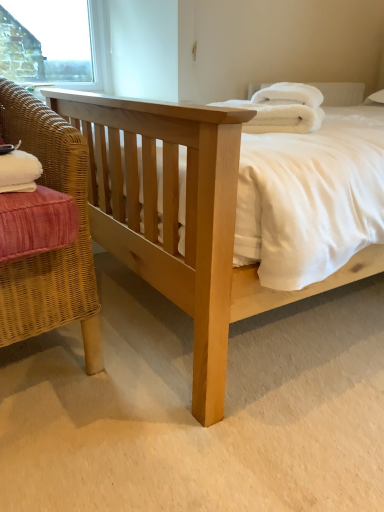
Where is `natural wood bed at center`? This screenshot has width=384, height=512. natural wood bed at center is located at coordinates (186, 220).

At what (x,y) coordinates should I click in order to perform the action: click on white fluffy pillow at upper center. Please return your answer as a coordinate pair (x, y). This screenshot has height=512, width=384. Looking at the image, I should click on (340, 93).

Measure the distance between point (82, 186) and camera.

A distance of 37.87 inches exists between point (82, 186) and camera.

Image resolution: width=384 pixels, height=512 pixels. In order to click on white plastic window frame at upper left in this screenshot , I will do `click(56, 42)`.

Is white plastic window frame at upper left looking in the opposite direction of woven wicker chair at left?

No, white plastic window frame at upper left is not facing away from woven wicker chair at left.

Where is `chair in front of the white plastic window frame at upper left`? chair in front of the white plastic window frame at upper left is located at coordinates pyautogui.click(x=51, y=252).

Considering the points (98, 12) and (57, 155), which point is behind, point (98, 12) or point (57, 155)?

Positioned behind is point (98, 12).

Based on the photo, is white plastic window frame at upper left behind woven wicker chair at left?

Yes, the depth of white plastic window frame at upper left is greater than that of woven wicker chair at left.

The image size is (384, 512). What are the coordinates of `chair in front of the white fluffy pillow at upper center` in the screenshot? It's located at (51, 252).

Which is behind, white fluffy pillow at upper center or woven wicker chair at left?

white fluffy pillow at upper center is behind.

Visually, is white fluffy pillow at upper center positioned to the left or to the right of woven wicker chair at left?

From the image, it's evident that white fluffy pillow at upper center is to the right of woven wicker chair at left.

Is white fluffy pillow at upper center next to woven wicker chair at left and touching it?

No, white fluffy pillow at upper center is not beside woven wicker chair at left.

Considering the points (223, 244) and (341, 86), which point is in front, point (223, 244) or point (341, 86)?

The point (223, 244) is in front.

Considering the sizes of objects natural wood bed at center and white fluffy pillow at upper center in the image provided, who is smaller, natural wood bed at center or white fluffy pillow at upper center?

With smaller size is white fluffy pillow at upper center.

From the image's perspective, which one is positioned higher, natural wood bed at center or white fluffy pillow at upper center?

white fluffy pillow at upper center appears higher in the image.

From a real-world perspective, which is physically below, natural wood bed at center or white fluffy pillow at upper center?

natural wood bed at center is physically lower.

From a real-world perspective, which object rests below the other?

In real-world perspective, woven wicker chair at left is lower.

Between point (34, 104) and point (149, 116), which one is positioned in front?

The point (149, 116) is in front.

Is woven wicker chair at left facing away from natural wood bed at center?

No, woven wicker chair at left's orientation is not away from natural wood bed at center.

Considering the positions of points (314, 89) and (355, 94), is point (314, 89) closer to camera compared to point (355, 94)?

Yes, it is in front of point (355, 94).

Where is `bath towel on the left of the white fluffy pillow at upper center`? The height and width of the screenshot is (512, 384). bath towel on the left of the white fluffy pillow at upper center is located at coordinates pos(282,109).

From a real-world perspective, is white fluffy bath towel at upper right physically below white fluffy pillow at upper center?

Yes, from a real-world perspective, white fluffy bath towel at upper right is below white fluffy pillow at upper center.

Can you confirm if natural wood bed at center is bigger than woven wicker chair at left?

Yes, natural wood bed at center is bigger than woven wicker chair at left.

Is natural wood bed at center turned away from woven wicker chair at left?

No, natural wood bed at center is not facing the opposite direction of woven wicker chair at left.

From a real-world perspective, relative to woven wicker chair at left, is natural wood bed at center vertically above or below?

natural wood bed at center is situated higher than woven wicker chair at left in the real world.

Which object is closer to the camera, natural wood bed at center or woven wicker chair at left?

natural wood bed at center is closer to the camera.

Would you say white plastic window frame at upper left is part of white fluffy pillow at upper center's contents?

No, white plastic window frame at upper left is not a part of white fluffy pillow at upper center.

Is the position of white fluffy pillow at upper center more distant than that of white plastic window frame at upper left?

No, the depth of white fluffy pillow at upper center is less than that of white plastic window frame at upper left.

Which is more to the left, white fluffy pillow at upper center or white plastic window frame at upper left?

white plastic window frame at upper left.

At what (x,y) coordinates should I click in order to perform the action: click on pillow that appears below the white plastic window frame at upper left (from the image's perspective). Please return your answer as a coordinate pair (x, y). This screenshot has width=384, height=512. Looking at the image, I should click on (340, 93).

Identify the location of window frame above the woven wicker chair at left (from the image's perspective). (56, 42).

Image resolution: width=384 pixels, height=512 pixels. I want to click on chair below the white fluffy pillow at upper center (from a real-world perspective), so click(x=51, y=252).

Estimate the real-world distances between objects in this image. Which object is closer to natural wood bed at center, white fluffy pillow at upper center or woven wicker chair at left?

Based on the image, woven wicker chair at left appears to be nearer to natural wood bed at center.

Which object lies further to the anchor point white fluffy bath towel at upper right, woven wicker chair at left or white fluffy pillow at upper center?

white fluffy pillow at upper center lies further to white fluffy bath towel at upper right than the other object.

When comparing their distances from white plastic window frame at upper left, does woven wicker chair at left or natural wood bed at center seem closer?

natural wood bed at center is closer to white plastic window frame at upper left.

Based on their spatial positions, is white fluffy pillow at upper center or white fluffy bath towel at upper right further from woven wicker chair at left?

white fluffy pillow at upper center lies further to woven wicker chair at left than the other object.

From the image, which object appears to be nearer to natural wood bed at center, white plastic window frame at upper left or white fluffy bath towel at upper right?

Among the two, white fluffy bath towel at upper right is located nearer to natural wood bed at center.

Which object lies further to the anchor point woven wicker chair at left, white fluffy bath towel at upper right or white plastic window frame at upper left?

white plastic window frame at upper left lies further to woven wicker chair at left than the other object.

When comparing their distances from white fluffy bath towel at upper right, does white plastic window frame at upper left or natural wood bed at center seem further?

The object further to white fluffy bath towel at upper right is white plastic window frame at upper left.

Based on their spatial positions, is white fluffy pillow at upper center or natural wood bed at center further from woven wicker chair at left?

white fluffy pillow at upper center.

Where is `pillow between woven wicker chair at left and natural wood bed at center`? The image size is (384, 512). pillow between woven wicker chair at left and natural wood bed at center is located at coordinates (340, 93).

Image resolution: width=384 pixels, height=512 pixels. I want to click on pillow situated between white plastic window frame at upper left and natural wood bed at center from left to right, so click(x=340, y=93).

Locate an element on the screen. The image size is (384, 512). bath towel positioned between woven wicker chair at left and white plastic window frame at upper left from near to far is located at coordinates (282, 109).

In order to click on bath towel positioned between natural wood bed at center and white fluffy pillow at upper center from near to far in this screenshot , I will do `click(282, 109)`.